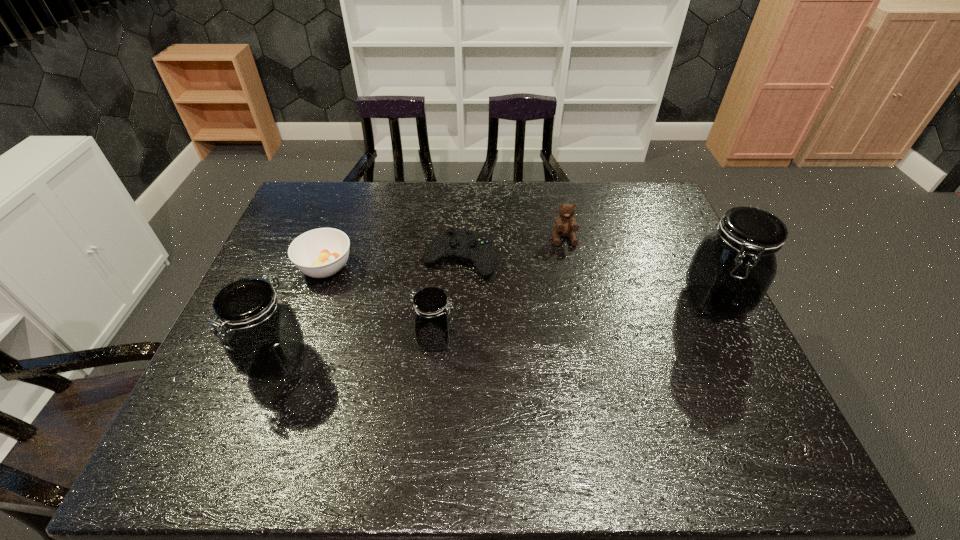
Locate an element on the screen. vacant region between the rightmost jar and the soup bowl is located at coordinates (520, 284).

You are a GUI agent. You are given a task and a screenshot of the screen. Output one action in this format:
    pyautogui.click(x=<x>, y=<y>)
    Task: Click on the vacant space that's between the rightmost jar and the soup bowl
    The height and width of the screenshot is (540, 960).
    Given the screenshot: What is the action you would take?
    pyautogui.click(x=520, y=284)

The image size is (960, 540). I want to click on free space between the shortest object and the soup bowl, so click(393, 263).

What are the coordinates of `object that can be found as the third closest to the rightmost object` in the screenshot? It's located at (432, 322).

Locate which object is the second closest to the rightmost jar. Please provide its 2D coordinates. Your answer should be formatted as a tuple, i.e. [(x, y)], where the tuple contains the x and y coordinates of a point satisfying the conditions above.

[(477, 248)]

The width and height of the screenshot is (960, 540). I want to click on the closest jar to the rightmost object, so click(x=432, y=322).

The width and height of the screenshot is (960, 540). Find the location of `jar that can be found as the third closest to the fourth tallest object`. jar that can be found as the third closest to the fourth tallest object is located at coordinates click(x=261, y=334).

Where is `free space that satisfies the following two spatial constraints: 1. on the face of the teddy bear; 2. on the lid of the second jar from right to left`? free space that satisfies the following two spatial constraints: 1. on the face of the teddy bear; 2. on the lid of the second jar from right to left is located at coordinates (585, 339).